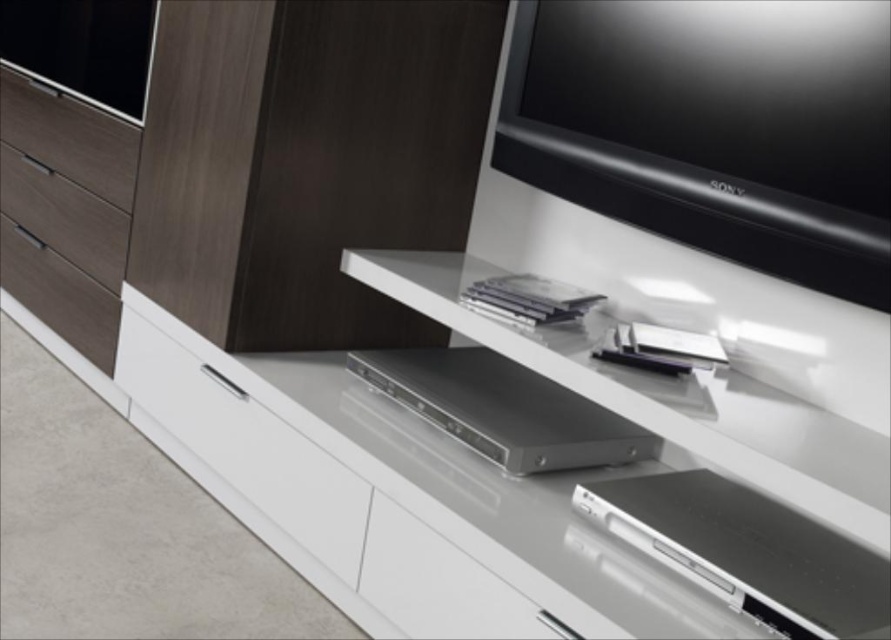
Does white glossy drawer at lower left have a greater height compared to matte wood drawer at upper left?

Correct, white glossy drawer at lower left is much taller as matte wood drawer at upper left.

Can you confirm if white glossy drawer at lower left is shorter than matte wood drawer at upper left?

In fact, white glossy drawer at lower left may be taller than matte wood drawer at upper left.

The image size is (891, 640). Identify the location of white glossy drawer at lower left. (247, 445).

Image resolution: width=891 pixels, height=640 pixels. Find the location of `black glossy tv at upper right`. black glossy tv at upper right is located at coordinates (714, 128).

Does black glossy tv at upper right have a greater height compared to matte wood drawer at upper left?

Indeed, black glossy tv at upper right has a greater height compared to matte wood drawer at upper left.

This screenshot has width=891, height=640. Find the location of `black glossy tv at upper right`. black glossy tv at upper right is located at coordinates (714, 128).

You are a GUI agent. You are given a task and a screenshot of the screen. Output one action in this format:
    pyautogui.click(x=<x>, y=<y>)
    Task: Click on the black glossy tv at upper right
    The height and width of the screenshot is (640, 891).
    Given the screenshot: What is the action you would take?
    (x=714, y=128)

This screenshot has height=640, width=891. What are the coordinates of `white glossy drawer at lower left` in the screenshot? It's located at (247, 445).

Is point (256, 474) positioned behind point (58, 228)?

No, (256, 474) is in front of (58, 228).

Where is `white glossy drawer at lower left`? white glossy drawer at lower left is located at coordinates (247, 445).